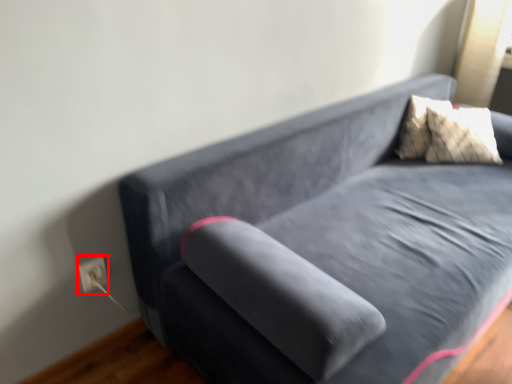
Question: From the image's perspective, what is the correct spatial relationship of electric outlet (annotated by the red box) in relation to hardwood?

Choices:
 (A) above
 (B) below

Answer: (A)